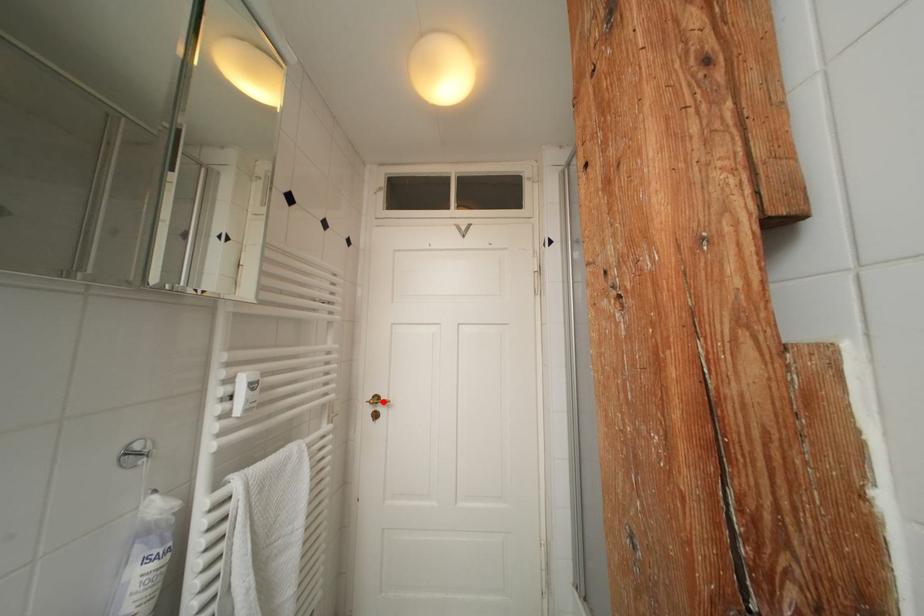
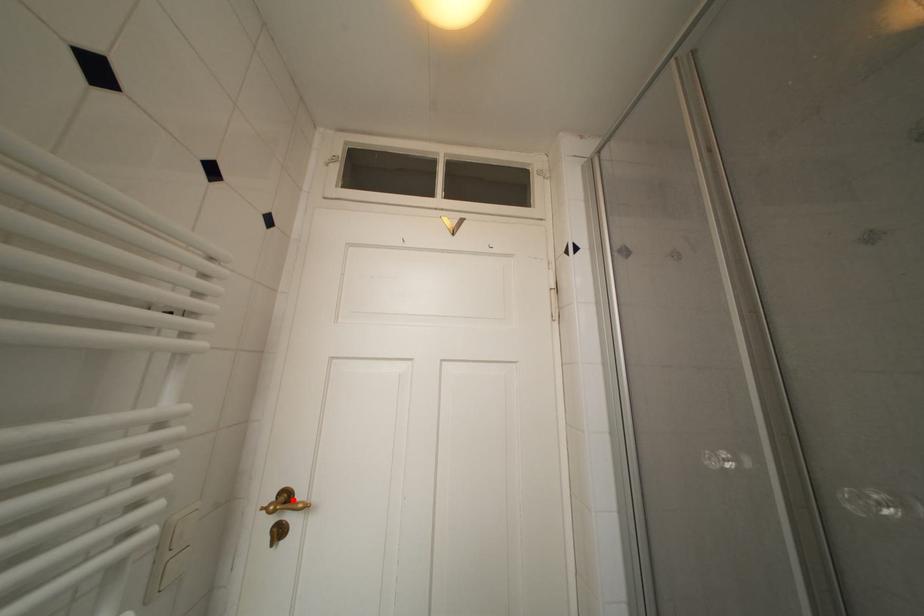
I am providing you with two images of the same scene from different viewpoints. A red point is marked on the first image and another point is marked on the second image. Do the highlighted points in image1 and image2 indicate the same real-world spot?

Yes